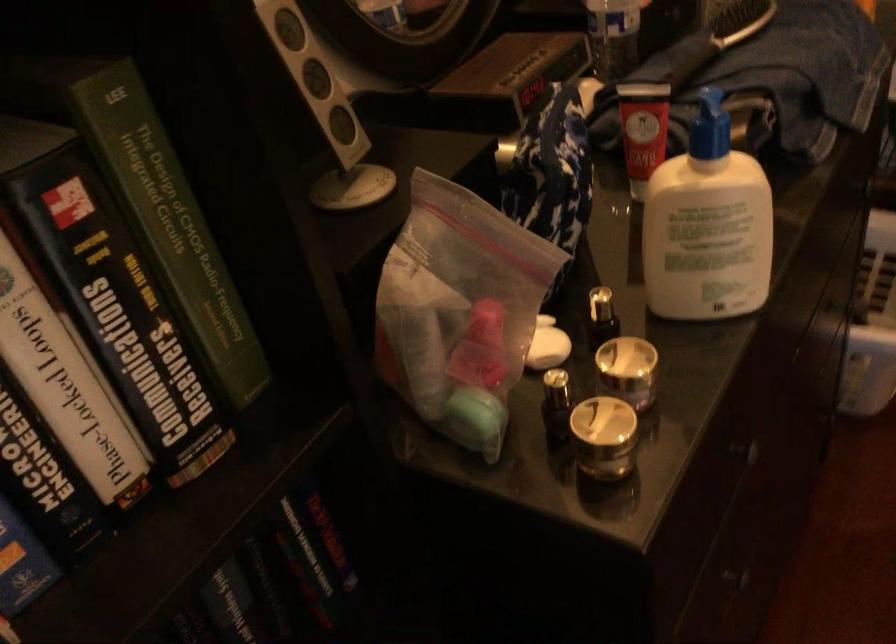
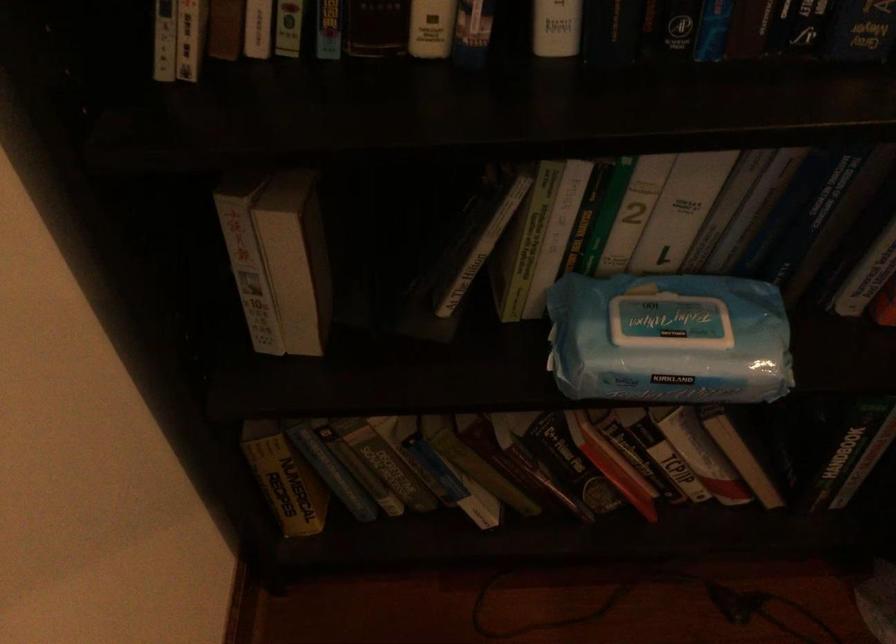
How did the camera likely rotate?

The rotation direction of the camera is left-down.